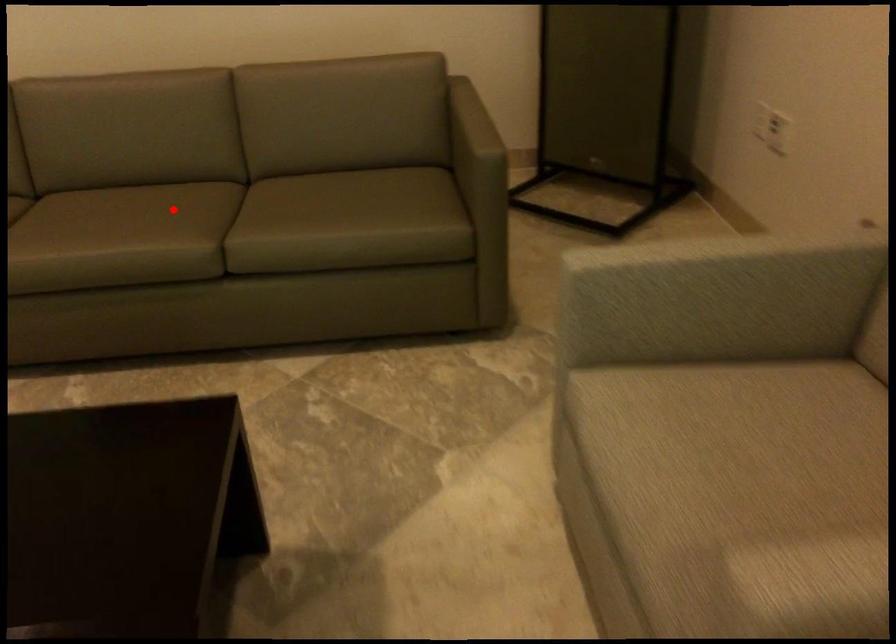
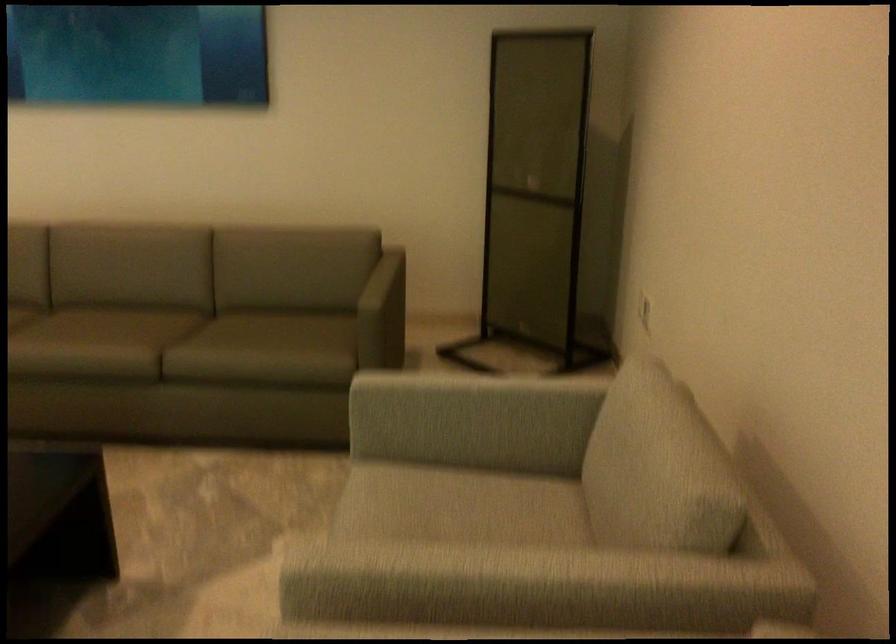
Question: I am providing you with two images of the same scene from different viewpoints. A red point is shown in image1. For the corresponding object point in image2, is it positioned nearer or farther from the camera?

Choices:
 (A) Nearer
 (B) Farther

Answer: (B)